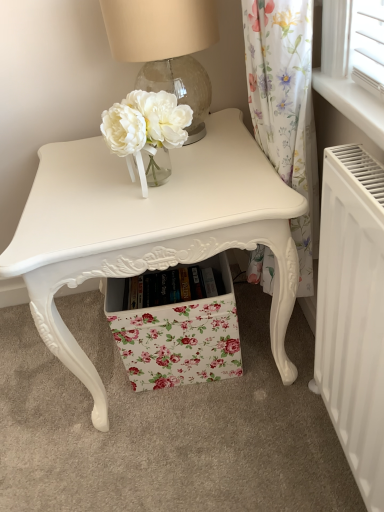
Identify the location of vacant space behind white matte radiator at lower right. Image resolution: width=384 pixels, height=512 pixels. (286, 392).